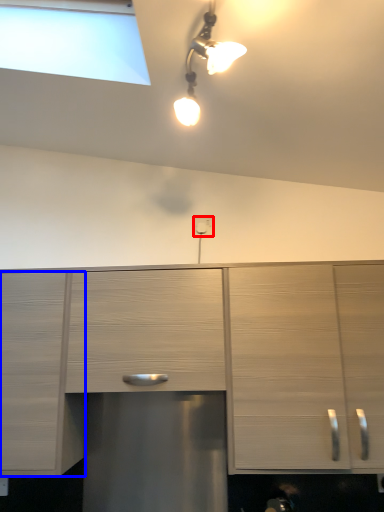
Question: Among these objects, which one is nearest to the camera, electric outlet (highlighted by a red box) or cabinetry (highlighted by a blue box)?

Choices:
 (A) electric outlet
 (B) cabinetry

Answer: (B)